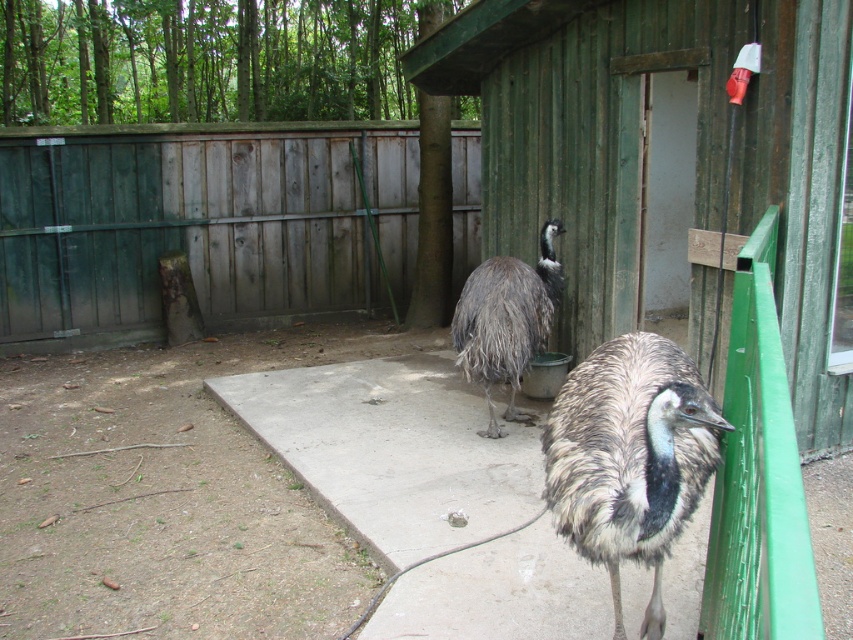
Question: Considering the real-world distances, which object is farthest from the wooden hut at center?

Choices:
 (A) weathered wood fence at left
 (B) brown speckled feathers at center

Answer: (A)

Question: Which object is positioned farthest from the gray feathered ostrich at center?

Choices:
 (A) brown speckled feathers at center
 (B) weathered wood fence at left

Answer: (B)

Question: Is weathered wood fence at left positioned at the back of gray feathered ostrich at center?

Choices:
 (A) yes
 (B) no

Answer: (A)

Question: Is wooden hut at center thinner than gray feathered ostrich at center?

Choices:
 (A) no
 (B) yes

Answer: (A)

Question: Is wooden hut at center positioned behind weathered wood fence at left?

Choices:
 (A) no
 (B) yes

Answer: (A)

Question: Which of the following is the farthest from the observer?

Choices:
 (A) wooden hut at center
 (B) brown speckled feathers at center
 (C) gray feathered ostrich at center

Answer: (C)